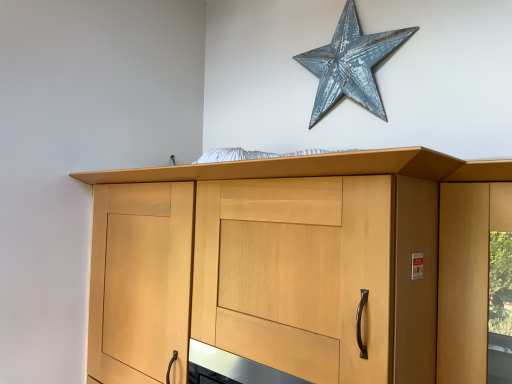
Question: Choose the correct answer: Is rusty metal star at upper center inside light wood/texture cupboard at center or outside it?

Choices:
 (A) inside
 (B) outside

Answer: (B)

Question: Based on their sizes in the image, would you say rusty metal star at upper center is bigger or smaller than light wood/texture cupboard at center?

Choices:
 (A) big
 (B) small

Answer: (B)

Question: Is point (373, 36) positioned closer to the camera than point (337, 377)?

Choices:
 (A) farther
 (B) closer

Answer: (A)

Question: From the image's perspective, is light wood/texture cupboard at center located above or below rusty metal star at upper center?

Choices:
 (A) below
 (B) above

Answer: (A)

Question: In terms of height, does light wood/texture cupboard at center look taller or shorter compared to rusty metal star at upper center?

Choices:
 (A) tall
 (B) short

Answer: (A)

Question: In the image, is light wood/texture cupboard at center positioned in front of or behind rusty metal star at upper center?

Choices:
 (A) front
 (B) behind

Answer: (A)

Question: From a real-world perspective, is light wood/texture cupboard at center positioned above or below rusty metal star at upper center?

Choices:
 (A) above
 (B) below

Answer: (B)